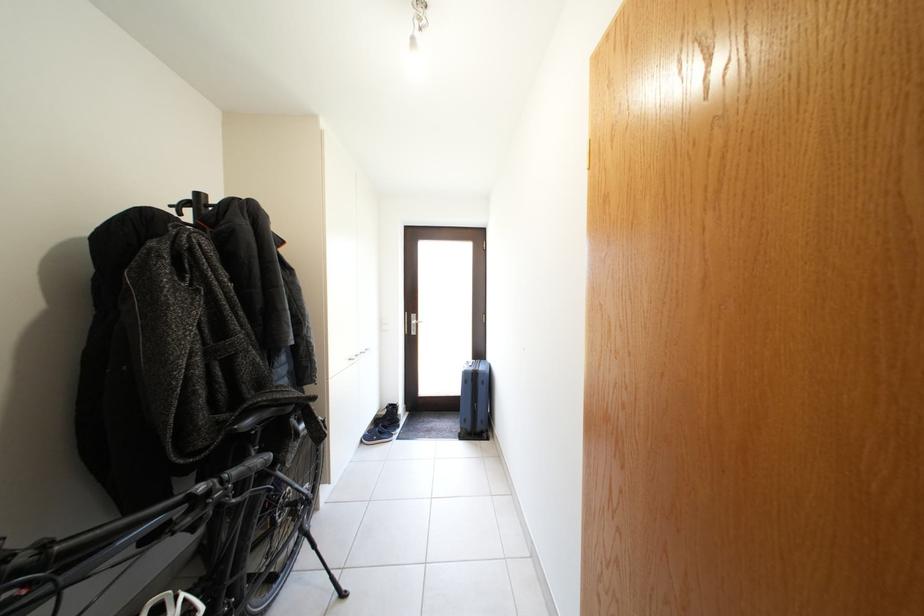
Where would you wear the blue slip-on shoe? Please return your answer as a coordinate pair (x, y).

(379, 435)